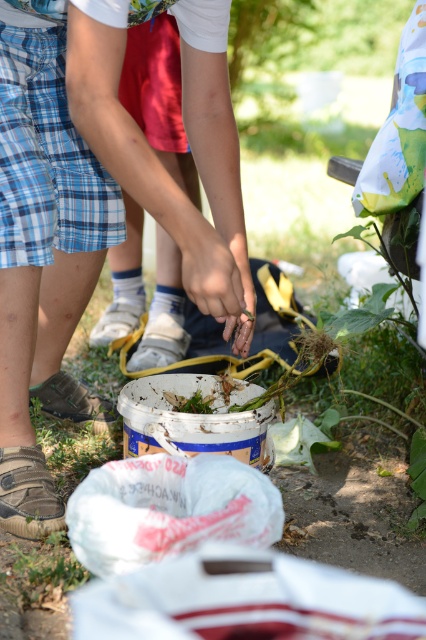
You are a photographer trying to capture a photo of the blue plaid shorts at center and the blue plaid shorts at lower left. Based on their positions, which one would appear larger in the photo?

The blue plaid shorts at lower left appears larger in the photo because it is closer to the camera than the blue plaid shorts at center, which is further away.

You are a photographer trying to capture both the blue plaid shorts at lower left and the blue plaid shorts at center in a single frame. Given that the camera can only focus on objects within a 1.2 meter width, will you be able to fit both into the frame without moving the camera?

The blue plaid shorts at lower left is narrower than the blue plaid shorts at center. Since the camera can focus on objects within a 1.2 meter width, and the total width required would depend on their combined or individual widths. However, the description only states the relative width between them but not their exact measurements. Without knowing the exact widths, it is impossible to determine if they fit within the 1.2 meter constraint.

You are a photographer trying to capture a closeup of the person sorting debris in the white bucket with blue and yellow markings. You notice two points in the scene at coordinates point (x=32, y=301) and point (x=13, y=577). Which point should you focus on to ensure the person is in focus?

You should focus on point (x=32, y=301) because it is closer to the camera than point (x=13, y=577), ensuring the person sorting debris is in focus.